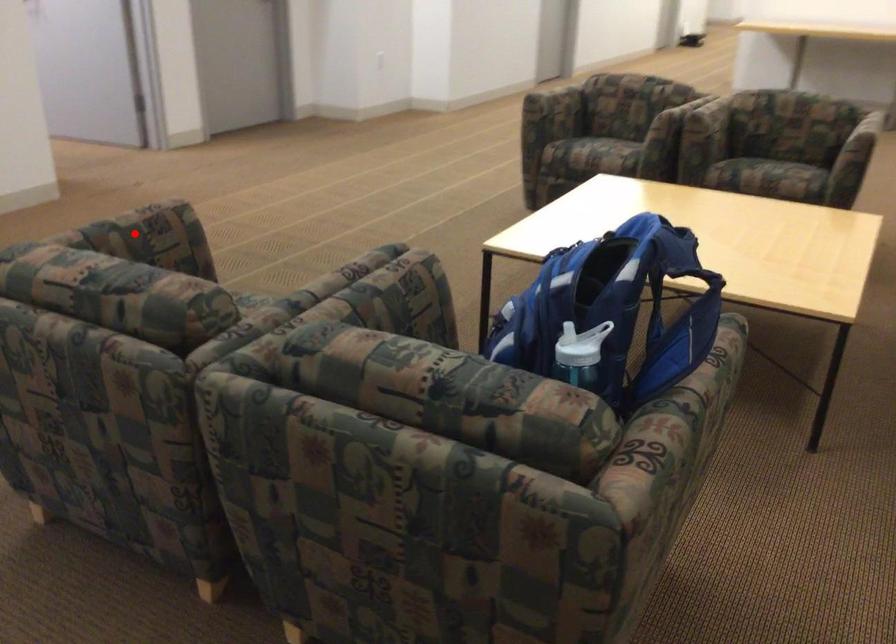
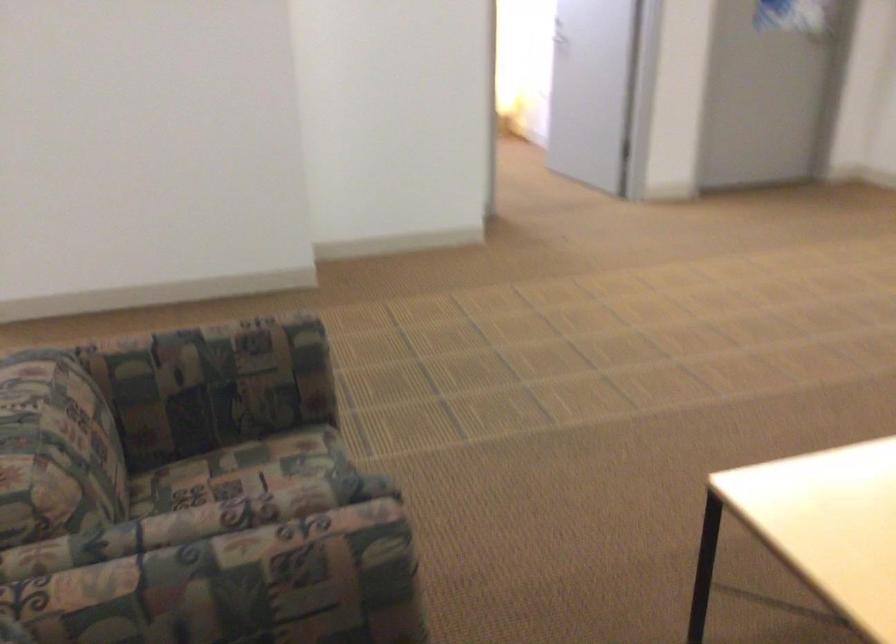
Question: I am providing you with two images of the same scene from different viewpoints. Image1 has a red point marked. In image2, the corresponding 3D location appears at what relative position? Reply with the corresponding letter.

Choices:
 (A) Closer
 (B) Farther

Answer: (A)